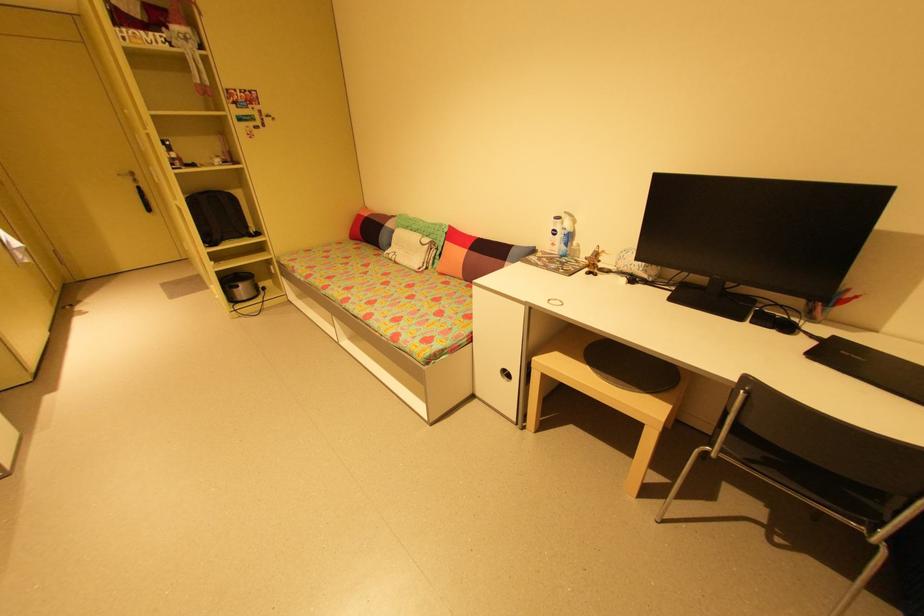
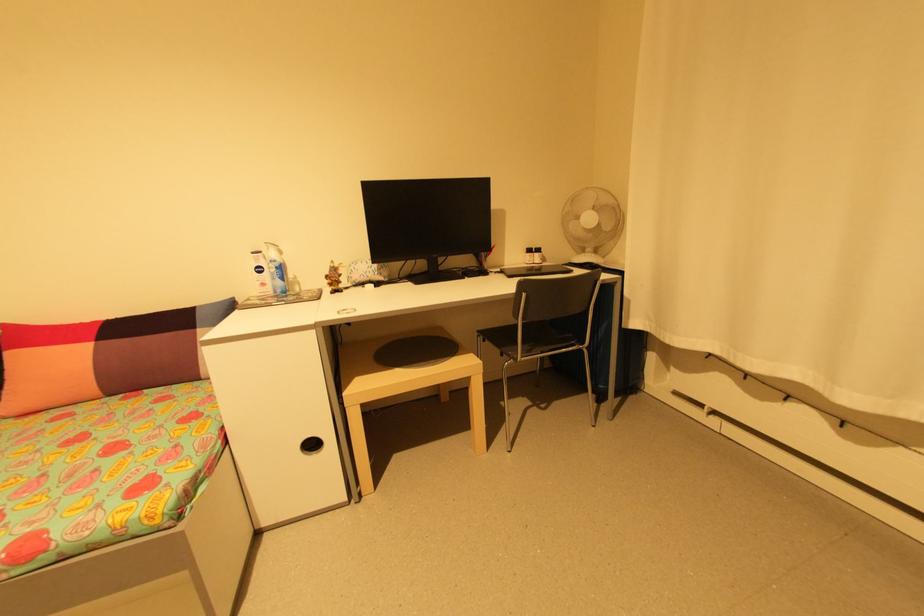
Where in the second image is the point corresponding to (638,387) from the first image?

(445, 360)